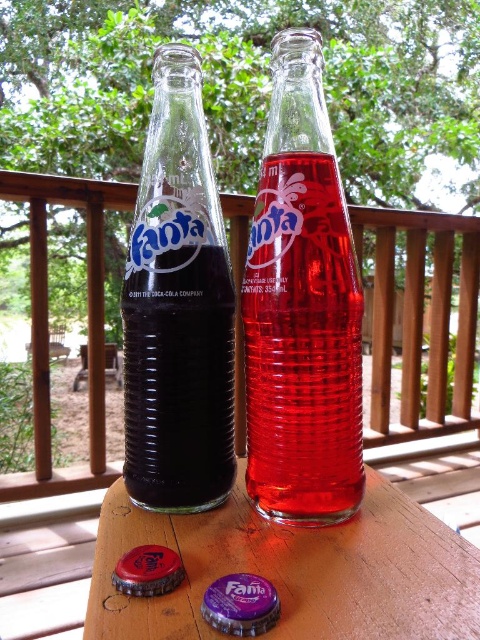
Question: Is translucent glass bottle at center to the right of wooden picnic table at center from the viewer's perspective?

Choices:
 (A) yes
 (B) no

Answer: (A)

Question: Considering the real-world distances, which object is farthest from the transparent glass bottles at center?

Choices:
 (A) translucent glass bottle at center
 (B) brushed metal bottle cap at lower left
 (C) purple matte bottle cap at lower center

Answer: (C)

Question: Which is nearer to the wooden table at center?

Choices:
 (A) purple matte bottle cap at lower center
 (B) translucent glass bottle at center
 (C) wooden picnic table at center

Answer: (A)

Question: Does translucent glass bottle at center have a lesser width compared to wooden table at center?

Choices:
 (A) yes
 (B) no

Answer: (A)

Question: Which is nearer to the brushed metal bottle cap at lower left?

Choices:
 (A) translucent glass bottle at center
 (B) purple matte bottle cap at lower center
 (C) wooden table at center

Answer: (B)

Question: Does wooden table at center have a greater width compared to wooden picnic table at center?

Choices:
 (A) no
 (B) yes

Answer: (B)